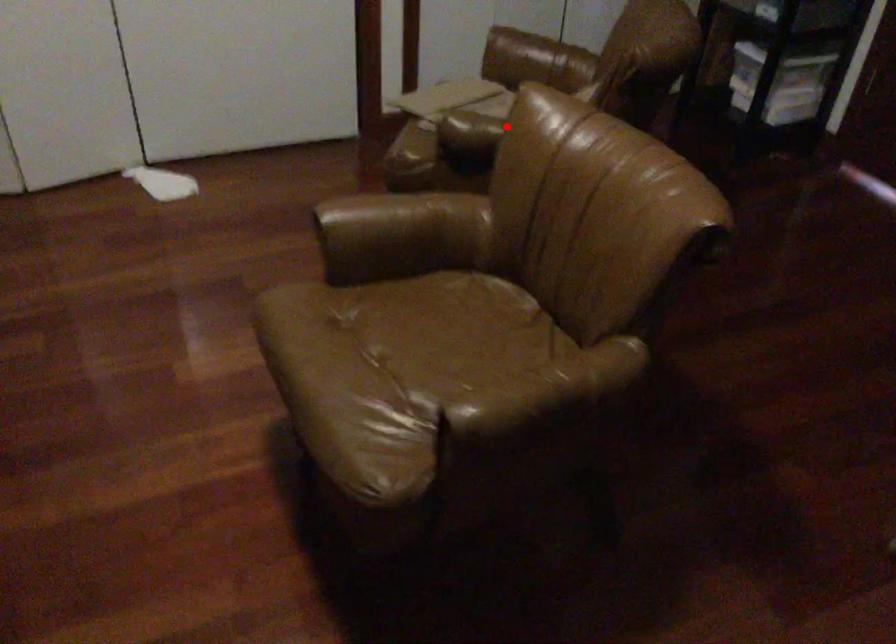
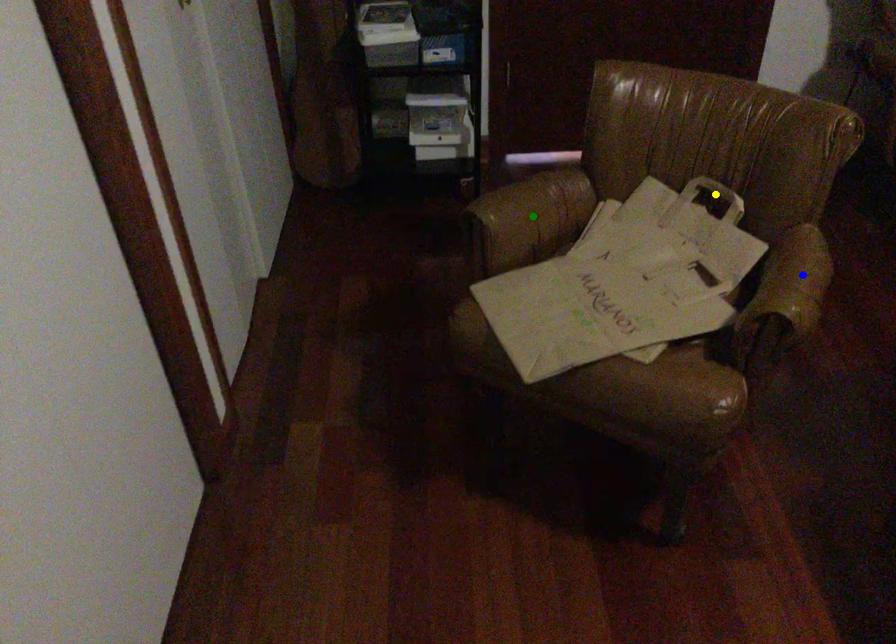
Question: I am providing you with two images of the same scene from different viewpoints. A red point is marked on the first image. You are given multiple points on the second image. Which point in image 2 represents the same 3d spot as the red point in image 1?

Choices:
 (A) green point
 (B) yellow point
 (C) blue point

Answer: (C)